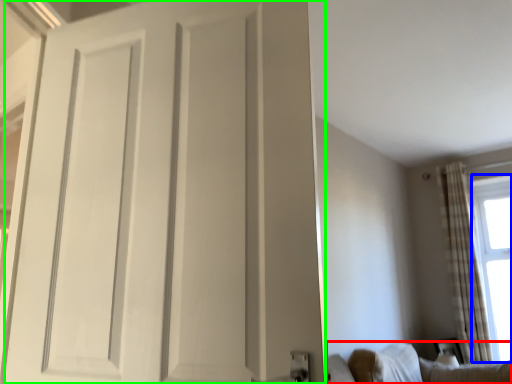
Question: Which is nearer to the furniture (highlighted by a red box)? window screen (highlighted by a blue box) or door (highlighted by a green box).

Choices:
 (A) window screen
 (B) door

Answer: (A)